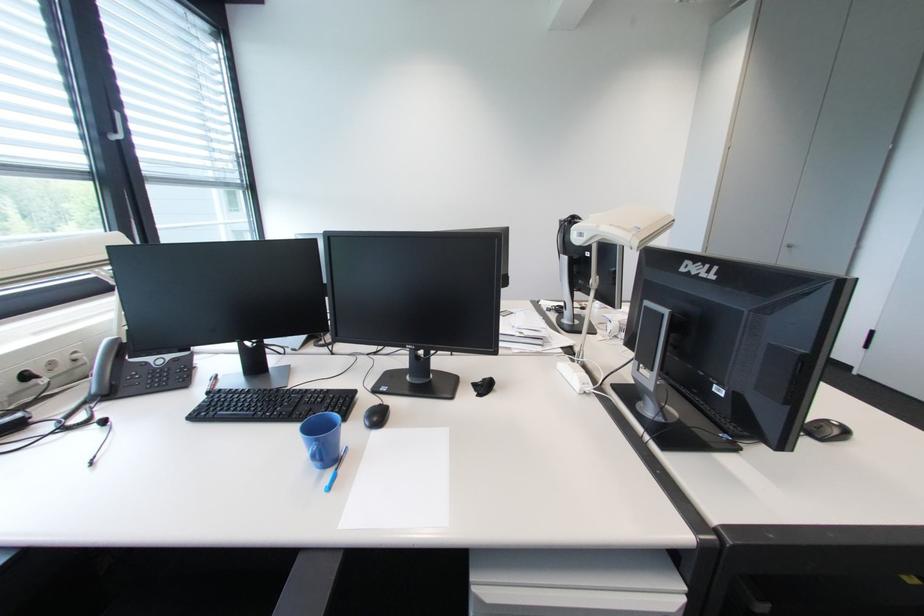
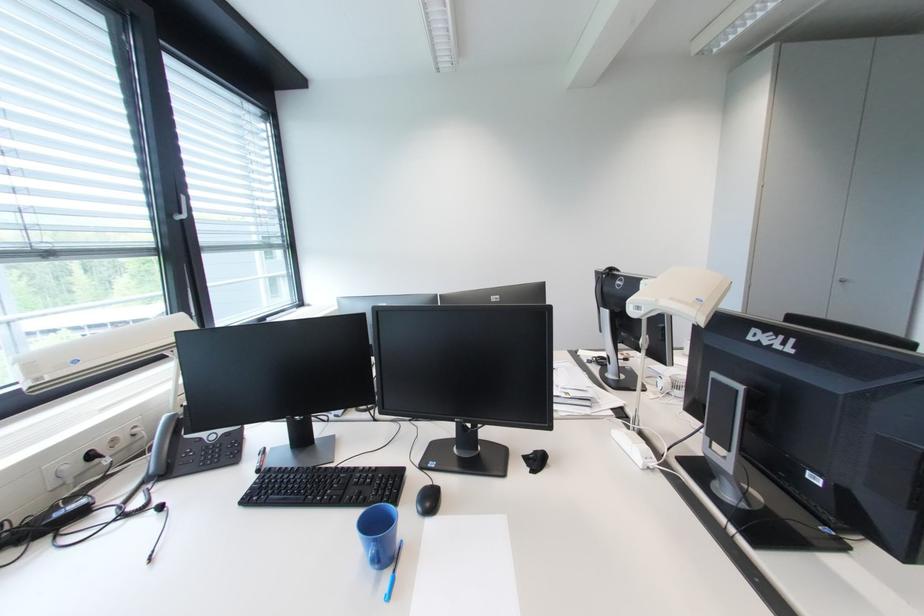
Where in the second image is the point corresponding to point (387, 406) from the first image?

(438, 485)